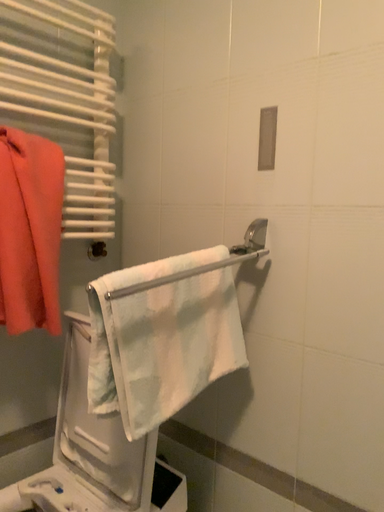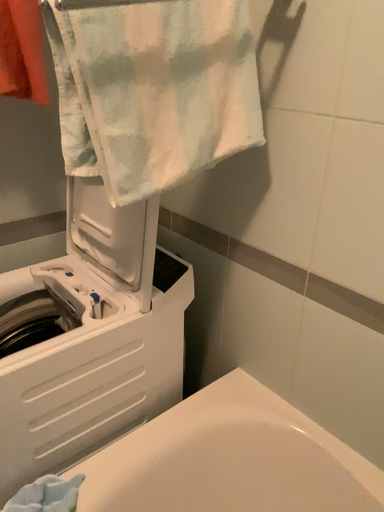
Question: How did the camera likely rotate when shooting the video?

Choices:
 (A) rotated downward
 (B) rotated upward

Answer: (A)